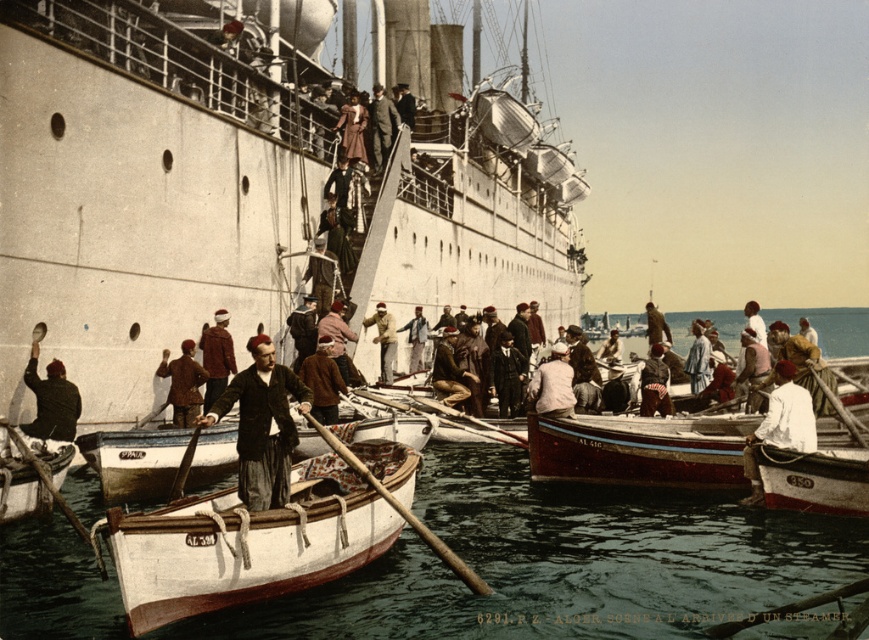
You are a passenger on the wooden polished boat at center and need to board the matte brown coat at center. Can you fit through the entrance? Please explain your reasoning based on their sizes.

The wooden polished boat at center is wider than the matte brown coat at center. Since the boat is wider, it might not fit through the entrance of the matte brown coat at center unless the entrance is sufficiently large. However, without knowing the exact dimensions of the entrance, we cannot definitively determine if it will fit. The answer is inconclusive based on the provided information.

You are a photographer at the harbor and want to capture both the dark brown leather jacket at center and the dark brown suit at center in a single frame. Which object should you focus on first to ensure both are in the shot?

The dark brown leather jacket at center is wider than the dark brown suit at center, so focusing on the dark brown leather jacket at center first will ensure both are included in the frame.